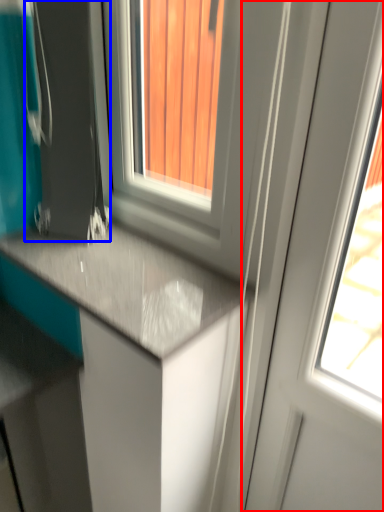
Question: Which of the following is the farthest to the observer, screen door (highlighted by a red box) or appliance (highlighted by a blue box)?

Choices:
 (A) screen door
 (B) appliance

Answer: (B)